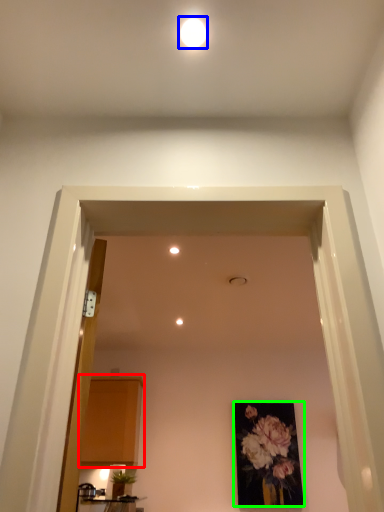
Question: Which object is the farthest from cabinetry (highlighted by a red box)? Choose among these: lighting (highlighted by a blue box) or picture frame (highlighted by a green box).

Choices:
 (A) lighting
 (B) picture frame

Answer: (A)